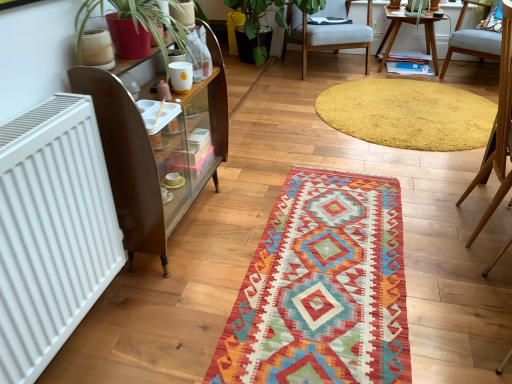
Locate an element on the screen. Image resolution: width=512 pixels, height=384 pixels. vacant area situated to the left side of multicolored woven mat at center, the 2th mat positioned from the top is located at coordinates (192, 267).